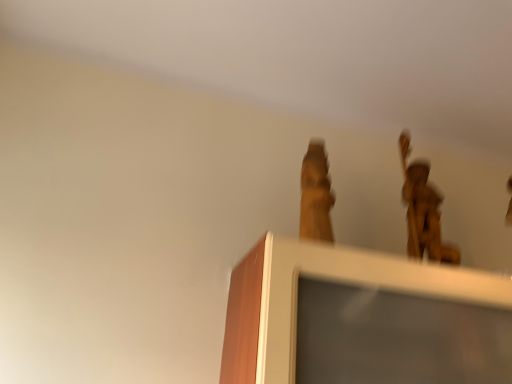
Question: Considering the relative sizes of wooden frame at upper center and bronze statue at upper right in the image provided, is wooden frame at upper center bigger than bronze statue at upper right?

Choices:
 (A) no
 (B) yes

Answer: (B)

Question: From the image's perspective, is wooden frame at upper center located beneath bronze statue at upper right?

Choices:
 (A) yes
 (B) no

Answer: (A)

Question: Considering the relative sizes of wooden frame at upper center and bronze statue at upper right in the image provided, is wooden frame at upper center wider than bronze statue at upper right?

Choices:
 (A) yes
 (B) no

Answer: (A)

Question: Would you say wooden frame at upper center is outside bronze statue at upper right?

Choices:
 (A) yes
 (B) no

Answer: (A)

Question: Is wooden frame at upper center to the left of bronze statue at upper right from the viewer's perspective?

Choices:
 (A) yes
 (B) no

Answer: (A)

Question: Does wooden frame at upper center lie in front of bronze statue at upper right?

Choices:
 (A) no
 (B) yes

Answer: (B)

Question: Is bronze statue at upper right oriented away from wooden frame at upper center?

Choices:
 (A) no
 (B) yes

Answer: (A)

Question: Considering the relative sizes of bronze statue at upper right and wooden frame at upper center in the image provided, is bronze statue at upper right shorter than wooden frame at upper center?

Choices:
 (A) no
 (B) yes

Answer: (A)

Question: Could you tell me if bronze statue at upper right is turned towards wooden frame at upper center?

Choices:
 (A) no
 (B) yes

Answer: (A)

Question: Is bronze statue at upper right taller than wooden frame at upper center?

Choices:
 (A) yes
 (B) no

Answer: (A)

Question: Is bronze statue at upper right to the left of wooden frame at upper center from the viewer's perspective?

Choices:
 (A) no
 (B) yes

Answer: (A)

Question: Are bronze statue at upper right and wooden frame at upper center making contact?

Choices:
 (A) yes
 (B) no

Answer: (B)

Question: From the image's perspective, is bronze statue at upper right above or below wooden frame at upper center?

Choices:
 (A) below
 (B) above

Answer: (B)